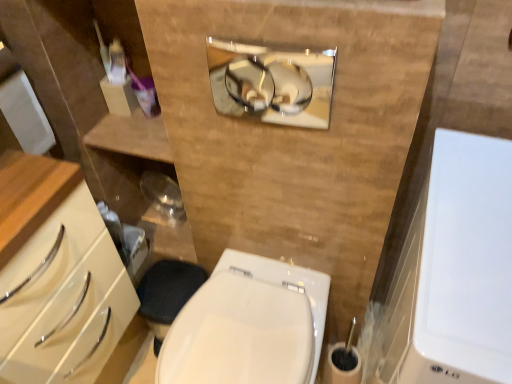
The width and height of the screenshot is (512, 384). What are the coordinates of `empty space that is ontop of white glossy bidet at center (from a real-world perspective)` in the screenshot? It's located at (242, 330).